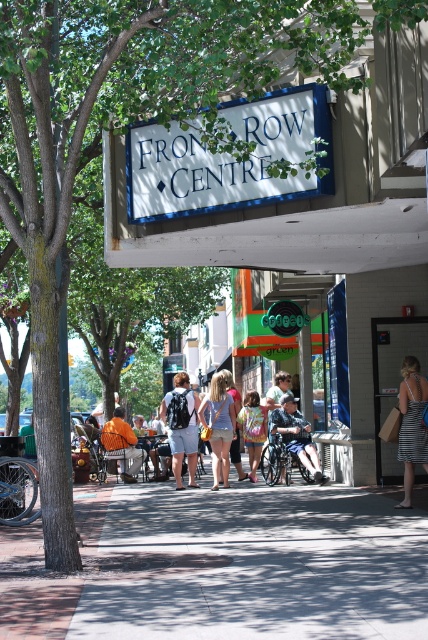
Question: Can you confirm if matte black backpack at center is bigger than dark blue fabric wheelchair at center?

Choices:
 (A) yes
 (B) no

Answer: (B)

Question: Estimate the real-world distances between objects in this image. Which object is closer to the matte black backpack at center?

Choices:
 (A) denim jacket at center
 (B) striped dress at lower right
 (C) orange fabric chair at center
 (D) tie-dye shirt at center

Answer: (D)

Question: Can you confirm if striped dress at lower right is positioned below matte black backpack at center?

Choices:
 (A) yes
 (B) no

Answer: (B)

Question: Which of these objects is positioned closest to the white plastic sign at upper center?

Choices:
 (A) matte black backpack at center
 (B) denim shorts at center
 (C) striped dress at lower right

Answer: (C)

Question: Considering the relative positions of dark blue fabric wheelchair at center and tie-dye shirt at center in the image provided, where is dark blue fabric wheelchair at center located with respect to tie-dye shirt at center?

Choices:
 (A) above
 (B) below

Answer: (A)

Question: Among these objects, which one is farthest from the camera?

Choices:
 (A) denim shorts at center
 (B) white plastic sign at upper center

Answer: (A)